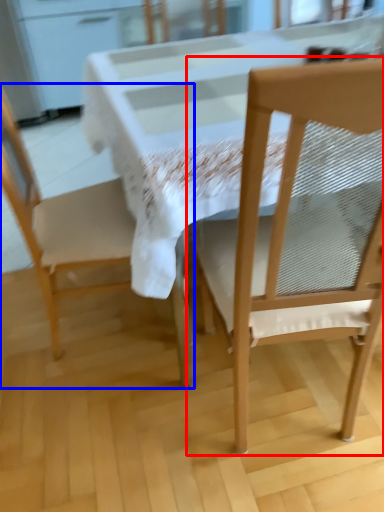
Question: Which object is closer to the camera taking this photo, chair (highlighted by a red box) or chair (highlighted by a blue box)?

Choices:
 (A) chair
 (B) chair

Answer: (A)